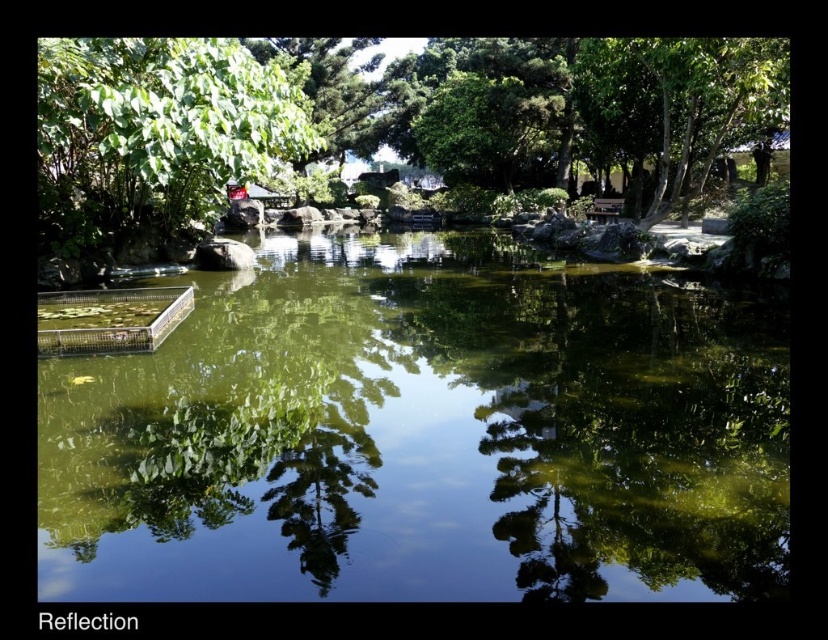
Does green translucent water at center come behind green leafy tree at upper right?

No, green translucent water at center is closer to the viewer.

Can you confirm if green translucent water at center is shorter than green leafy tree at upper right?

Yes.

Measure the distance between point (258,392) and camera.

Point (258,392) is 5.62 meters away from camera.

Locate an element on the screen. The width and height of the screenshot is (828, 640). green translucent water at center is located at coordinates (422, 436).

Is green leafy tree at upper left taller than green leafy tree at upper right?

In fact, green leafy tree at upper left may be shorter than green leafy tree at upper right.

Which of these two, green leafy tree at upper left or green leafy tree at upper right, stands shorter?

green leafy tree at upper left

This screenshot has height=640, width=828. Describe the element at coordinates (153, 132) in the screenshot. I see `green leafy tree at upper left` at that location.

At what (x,y) coordinates should I click in order to perform the action: click on green leafy tree at upper left. Please return your answer as a coordinate pair (x, y). Looking at the image, I should click on (153, 132).

Which is behind, point (383, 371) or point (46, 237)?

Point (46, 237)

Is green translucent water at center taller than green leafy tree at upper left?

Correct, green translucent water at center is much taller as green leafy tree at upper left.

Find the location of a particular element. green translucent water at center is located at coordinates (422, 436).